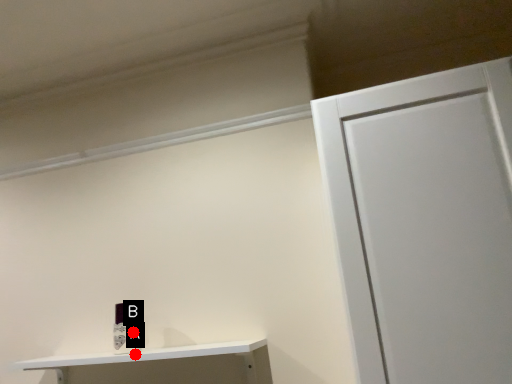
Question: Two points are circled on the image, labeled by A and B beside each circle. Which point is closer to the camera taking this photo?

Choices:
 (A) A is closer
 (B) B is closer

Answer: (A)